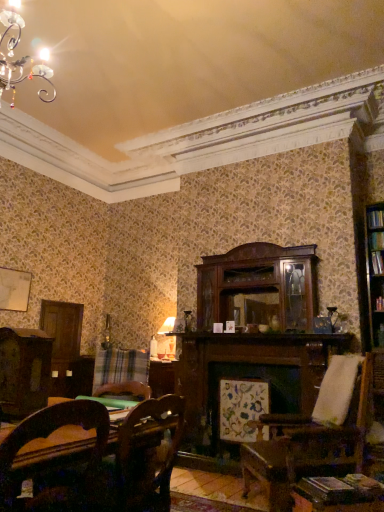
Question: Considering the relative sizes of wooden table at lower right and hardcover book at right in the image provided, is wooden table at lower right thinner than hardcover book at right?

Choices:
 (A) yes
 (B) no

Answer: (B)

Question: From the image's perspective, is wooden table at lower right located beneath hardcover book at right?

Choices:
 (A) yes
 (B) no

Answer: (A)

Question: Can you confirm if wooden table at lower right is wider than hardcover book at right?

Choices:
 (A) yes
 (B) no

Answer: (A)

Question: Considering the relative positions of wooden table at lower right and hardcover book at right in the image provided, is wooden table at lower right to the right of hardcover book at right from the viewer's perspective?

Choices:
 (A) no
 (B) yes

Answer: (A)

Question: From a real-world perspective, is wooden table at lower right beneath hardcover book at right?

Choices:
 (A) no
 (B) yes

Answer: (B)

Question: Does wooden table at lower right appear on the left side of hardcover book at right?

Choices:
 (A) yes
 (B) no

Answer: (A)

Question: Considering the relative positions of wooden chair at lower left and wooden table at lower right in the image provided, is wooden chair at lower left behind wooden table at lower right?

Choices:
 (A) yes
 (B) no

Answer: (B)

Question: Is wooden chair at lower left outside of wooden table at lower right?

Choices:
 (A) no
 (B) yes

Answer: (B)

Question: Is wooden chair at lower left taller than wooden table at lower right?

Choices:
 (A) no
 (B) yes

Answer: (B)

Question: From the image's perspective, does wooden chair at lower left appear lower than wooden table at lower right?

Choices:
 (A) no
 (B) yes

Answer: (A)

Question: Can you confirm if wooden chair at lower left is positioned to the left of wooden table at lower right?

Choices:
 (A) yes
 (B) no

Answer: (A)

Question: Is wooden chair at lower left closer to camera compared to wooden table at lower right?

Choices:
 (A) yes
 (B) no

Answer: (A)

Question: Are hardcover book at right and plaid fabric at lower left located far from each other?

Choices:
 (A) yes
 (B) no

Answer: (A)